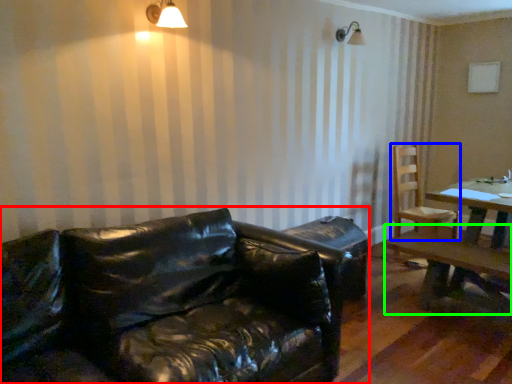
Question: Based on their relative distances, which object is farther from studio couch (highlighted by a red box)? Choose from chair (highlighted by a blue box) and table (highlighted by a green box).

Choices:
 (A) chair
 (B) table

Answer: (A)